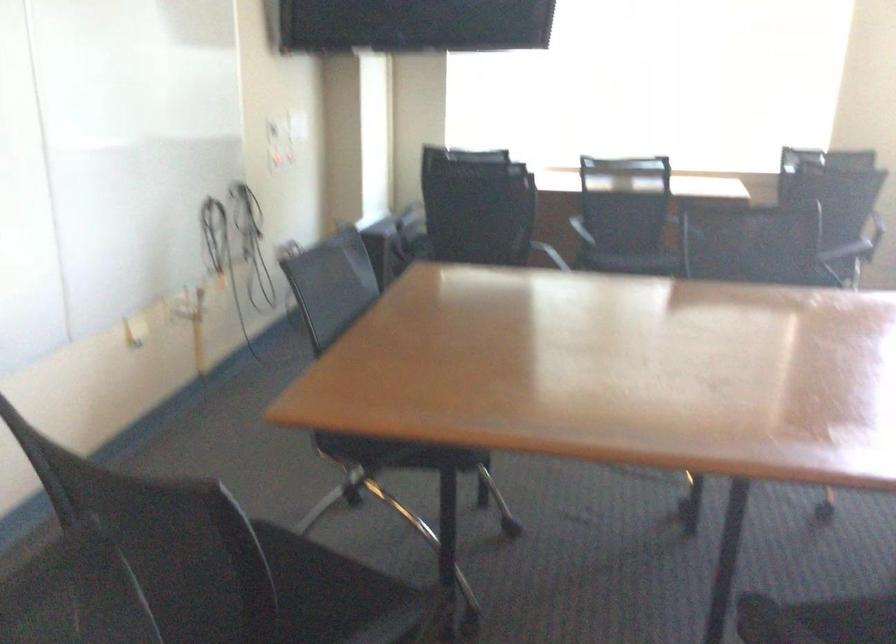
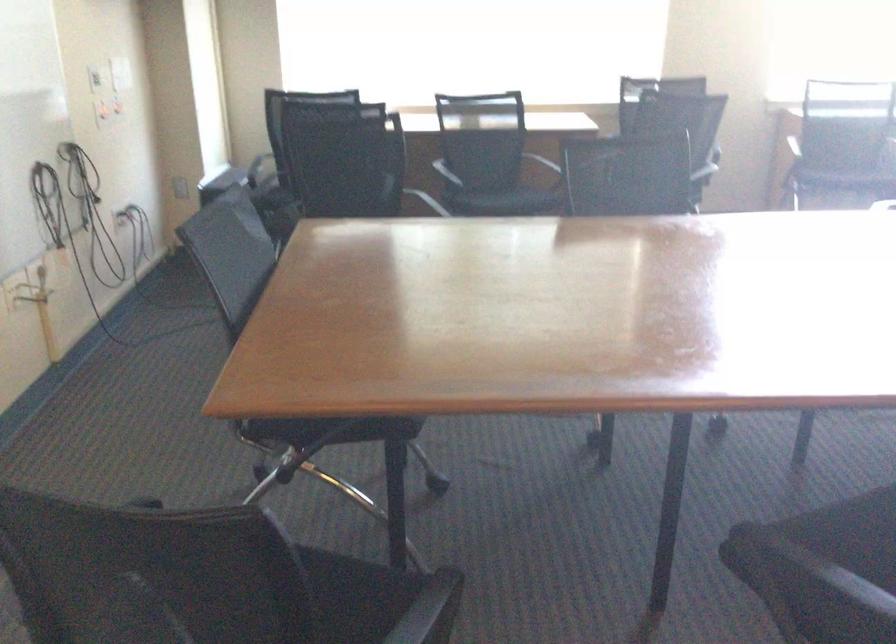
Question: How did the camera likely rotate?

Choices:
 (A) Left
 (B) Right
 (C) Up
 (D) Down

Answer: (B)